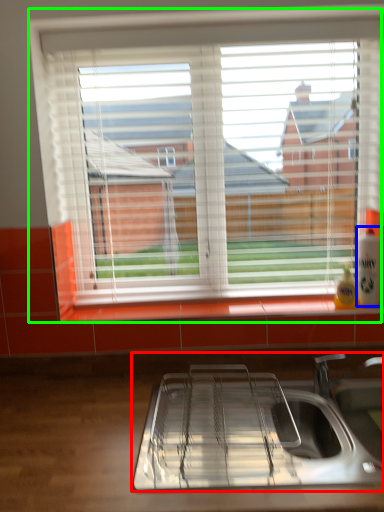
Question: Based on their relative distances, which object is farther from sink (highlighted by a red box)? Choose from beverage (highlighted by a blue box) and window (highlighted by a green box).

Choices:
 (A) beverage
 (B) window

Answer: (B)